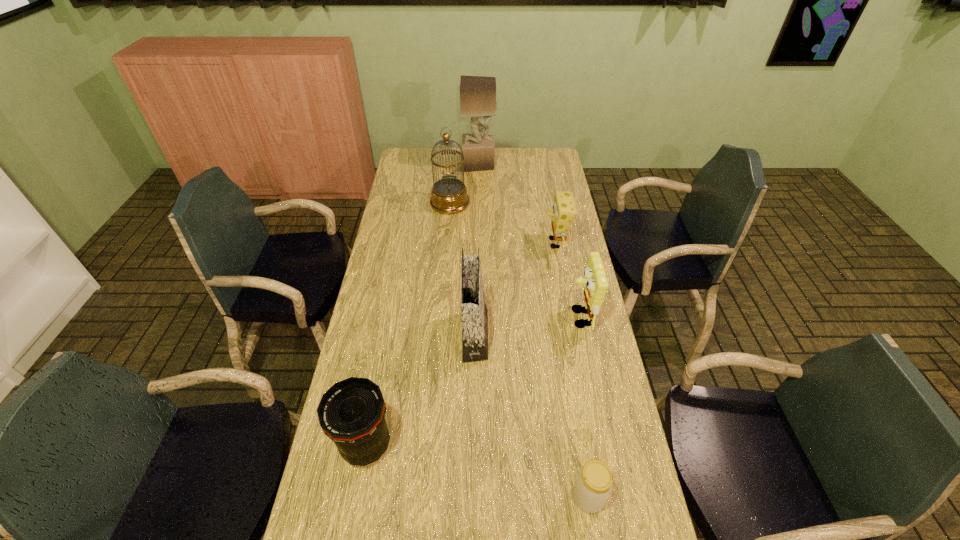
The width and height of the screenshot is (960, 540). I want to click on the farthest object, so click(x=477, y=93).

I want to click on the sixth nearest object, so click(449, 195).

Find the location of a particular element. Image resolution: width=960 pixels, height=540 pixels. shopping bag is located at coordinates tap(474, 311).

Where is `the nearer sponge`? The image size is (960, 540). the nearer sponge is located at coordinates (596, 285).

The width and height of the screenshot is (960, 540). Find the location of `the fifth nearest object`. the fifth nearest object is located at coordinates (564, 208).

Identify the location of the leftmost object. (351, 413).

Identify the location of telephoto lens. The width and height of the screenshot is (960, 540). (351, 413).

The image size is (960, 540). Find the location of `the shortest object`. the shortest object is located at coordinates (593, 485).

What are the coordinates of `jar` in the screenshot? It's located at (593, 485).

Identify the location of vacant space positioned 0.290m on the front-facing side of the farthest object. (553, 164).